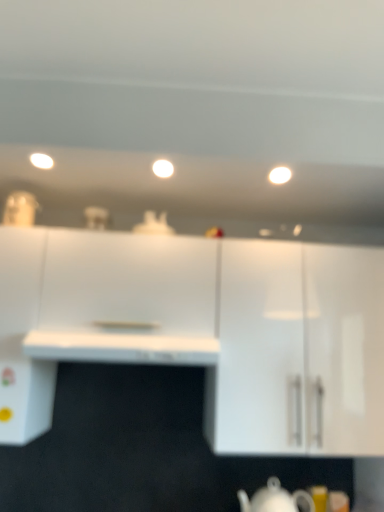
Measure the distance between white matte cabinet at left, the second cabinetry from the right, and camera.

A distance of 1.39 meters exists between white matte cabinet at left, the second cabinetry from the right, and camera.

Describe the element at coordinates (163, 168) in the screenshot. The image size is (384, 512). I see `white glossy light fixture at center, which appears as the 2th lighting when viewed from the right` at that location.

Find the location of `white glossy teapot at lower center`. white glossy teapot at lower center is located at coordinates (275, 499).

From a real-world perspective, is white glossy light fixture at center, the 2th lighting from the left, above or below white glossy light fixture at upper left, which is the first lighting from left to right?

white glossy light fixture at center, the 2th lighting from the left, is below white glossy light fixture at upper left, which is the first lighting from left to right.

Does white glossy light fixture at center, the 2th lighting from the left, contain white glossy light fixture at upper left, the 3th lighting when ordered from right to left?

No, white glossy light fixture at upper left, the 3th lighting when ordered from right to left, is not a part of white glossy light fixture at center, the 2th lighting from the left.

Would you consider white glossy light fixture at center, which appears as the 2th lighting when viewed from the right, to be distant from white glossy light fixture at upper left, the 3th lighting when ordered from right to left?

No.

Is white glossy counter top at center beside white glossy cabinet at upper right, the second cabinetry viewed from the left?

No, white glossy counter top at center is not beside white glossy cabinet at upper right, the second cabinetry viewed from the left.

Is white glossy counter top at center positioned with its back to white glossy cabinet at upper right, marked as the 1th cabinetry in a right-to-left arrangement?

No, white glossy counter top at center is not facing away from white glossy cabinet at upper right, marked as the 1th cabinetry in a right-to-left arrangement.

Considering the positions of objects white glossy counter top at center and white glossy cabinet at upper right, the second cabinetry viewed from the left, in the image provided, who is more to the right, white glossy counter top at center or white glossy cabinet at upper right, the second cabinetry viewed from the left,?

white glossy cabinet at upper right, the second cabinetry viewed from the left, is more to the right.

How different are the orientations of white glossy counter top at center and white glossy cabinet at upper right, marked as the 1th cabinetry in a right-to-left arrangement, in degrees?

9.96e-06 degrees separate the facing orientations of white glossy counter top at center and white glossy cabinet at upper right, marked as the 1th cabinetry in a right-to-left arrangement.

Visually, is white glossy teapot at lower center positioned to the left or to the right of white glossy cabinet at upper right, the second cabinetry viewed from the left?

In the image, white glossy teapot at lower center appears on the left side of white glossy cabinet at upper right, the second cabinetry viewed from the left.

Who is shorter, white glossy teapot at lower center or white glossy cabinet at upper right, the second cabinetry viewed from the left?

white glossy teapot at lower center is shorter.

Looking at this image, would you say white glossy teapot at lower center is a long distance from white glossy cabinet at upper right, marked as the 1th cabinetry in a right-to-left arrangement?

Actually, white glossy teapot at lower center and white glossy cabinet at upper right, marked as the 1th cabinetry in a right-to-left arrangement, are a little close together.

From a real-world perspective, which is physically above, white glossy teapot at lower center or white glossy cabinet at upper right, the second cabinetry viewed from the left?

white glossy cabinet at upper right, the second cabinetry viewed from the left, is physically above.

Is white matte cabinet at left, acting as the 1th cabinetry starting from the left, taller than white glossy light fixture at upper left, which is the first lighting from left to right?

Correct, white matte cabinet at left, acting as the 1th cabinetry starting from the left, is much taller as white glossy light fixture at upper left, which is the first lighting from left to right.

Which object is further away from the camera taking this photo, white matte cabinet at left, acting as the 1th cabinetry starting from the left, or white glossy light fixture at upper left, the 3th lighting when ordered from right to left?

Positioned behind is white glossy light fixture at upper left, the 3th lighting when ordered from right to left.

Is white matte cabinet at left, acting as the 1th cabinetry starting from the left, touching white glossy light fixture at upper left, the 3th lighting when ordered from right to left?

No, white matte cabinet at left, acting as the 1th cabinetry starting from the left, is not making contact with white glossy light fixture at upper left, the 3th lighting when ordered from right to left.

Is white matte cabinet at left, acting as the 1th cabinetry starting from the left, positioned with its back to white glossy light fixture at upper left, the 3th lighting when ordered from right to left?

That's not correct — white matte cabinet at left, acting as the 1th cabinetry starting from the left, is not looking away from white glossy light fixture at upper left, the 3th lighting when ordered from right to left.

This screenshot has height=512, width=384. I want to click on jug on the right of white glossy light fixture at upper left, which is the first lighting from left to right, so click(x=275, y=499).

From a real-world perspective, is white glossy teapot at lower center above or below white glossy light fixture at upper left, which is the first lighting from left to right?

In terms of real-world spatial position, white glossy teapot at lower center is below white glossy light fixture at upper left, which is the first lighting from left to right.

Looking at their sizes, would you say white glossy teapot at lower center is wider or thinner than white glossy light fixture at upper left, the 3th lighting when ordered from right to left?

Clearly, white glossy teapot at lower center has more width compared to white glossy light fixture at upper left, the 3th lighting when ordered from right to left.

Considering the relative positions of white matte cabinet at left, acting as the 1th cabinetry starting from the left, and white glossy light at upper center, which is counted as the 3th lighting, starting from the left, in the image provided, is white matte cabinet at left, acting as the 1th cabinetry starting from the left, to the right of white glossy light at upper center, which is counted as the 3th lighting, starting from the left, from the viewer's perspective?

No, white matte cabinet at left, acting as the 1th cabinetry starting from the left, is not to the right of white glossy light at upper center, which is counted as the 3th lighting, starting from the left.

Does point (43, 239) lie behind point (278, 175)?

Yes, point (43, 239) is farther from viewer.

Can you confirm if white matte cabinet at left, acting as the 1th cabinetry starting from the left, is bigger than white glossy light at upper center, marked as the first lighting in a right-to-left arrangement?

Indeed, white matte cabinet at left, acting as the 1th cabinetry starting from the left, has a larger size compared to white glossy light at upper center, marked as the first lighting in a right-to-left arrangement.

In the image, is white matte cabinet at left, acting as the 1th cabinetry starting from the left, positioned in front of or behind white glossy light at upper center, which is counted as the 3th lighting, starting from the left?

white matte cabinet at left, acting as the 1th cabinetry starting from the left, is positioned closer to the viewer than white glossy light at upper center, which is counted as the 3th lighting, starting from the left.

From a real-world perspective, which is physically above, white glossy light fixture at upper left, which is the first lighting from left to right, or white glossy light at upper center, marked as the first lighting in a right-to-left arrangement?

From a 3D spatial view, white glossy light at upper center, marked as the first lighting in a right-to-left arrangement, is above.

Based on their positions, is white glossy light fixture at upper left, which is the first lighting from left to right, located to the left or right of white glossy light at upper center, marked as the first lighting in a right-to-left arrangement?

white glossy light fixture at upper left, which is the first lighting from left to right, is to the left of white glossy light at upper center, marked as the first lighting in a right-to-left arrangement.

Choose the correct answer: Is white glossy light fixture at upper left, the 3th lighting when ordered from right to left, inside white glossy light at upper center, which is counted as the 3th lighting, starting from the left, or outside it?

white glossy light fixture at upper left, the 3th lighting when ordered from right to left, is not enclosed by white glossy light at upper center, which is counted as the 3th lighting, starting from the left.

Based on the photo, considering the relative sizes of white glossy light fixture at upper left, which is the first lighting from left to right, and white glossy light at upper center, marked as the first lighting in a right-to-left arrangement, in the image provided, is white glossy light fixture at upper left, which is the first lighting from left to right, taller than white glossy light at upper center, marked as the first lighting in a right-to-left arrangement,?

Yes.

Image resolution: width=384 pixels, height=512 pixels. Identify the location of the 1st lighting positioned above the white glossy light fixture at center, the 2th lighting from the left (from a real-world perspective). (41, 160).

I want to click on cabinetry that is on the right side of white glossy counter top at center, so click(298, 350).

When comparing their distances from white glossy counter top at center, does white glossy light fixture at upper left, the 3th lighting when ordered from right to left, or white glossy teapot at lower center seem closer?

Among the two, white glossy teapot at lower center is located nearer to white glossy counter top at center.

From the image, which object appears to be nearer to white glossy teapot at lower center, white glossy cabinet at upper right, marked as the 1th cabinetry in a right-to-left arrangement, or white glossy counter top at center?

white glossy cabinet at upper right, marked as the 1th cabinetry in a right-to-left arrangement, is positioned closer to the anchor white glossy teapot at lower center.

Estimate the real-world distances between objects in this image. Which object is further from white matte cabinet at left, the second cabinetry from the right, white glossy teapot at lower center or white glossy light at upper center, which is counted as the 3th lighting, starting from the left?

white glossy light at upper center, which is counted as the 3th lighting, starting from the left, lies further to white matte cabinet at left, the second cabinetry from the right, than the other object.

Which object lies nearer to the anchor point white glossy cabinet at upper right, marked as the 1th cabinetry in a right-to-left arrangement, white glossy teapot at lower center or white glossy light fixture at center, which appears as the 2th lighting when viewed from the right?

The object closer to white glossy cabinet at upper right, marked as the 1th cabinetry in a right-to-left arrangement, is white glossy teapot at lower center.

From the picture: Based on their spatial positions, is white matte cabinet at left, the second cabinetry from the right, or white glossy light fixture at upper left, the 3th lighting when ordered from right to left, closer to white glossy teapot at lower center?

white matte cabinet at left, the second cabinetry from the right, is closer to white glossy teapot at lower center.

Considering their positions, is white glossy teapot at lower center positioned closer to white matte cabinet at left, the second cabinetry from the right, than white glossy cabinet at upper right, marked as the 1th cabinetry in a right-to-left arrangement?

white glossy cabinet at upper right, marked as the 1th cabinetry in a right-to-left arrangement.

Based on their spatial positions, is white matte cabinet at left, acting as the 1th cabinetry starting from the left, or white glossy counter top at center closer to white glossy teapot at lower center?

white glossy counter top at center lies closer to white glossy teapot at lower center than the other object.

From the picture: When comparing their distances from white glossy light fixture at center, the 2th lighting from the left, does white glossy teapot at lower center or white glossy cabinet at upper right, marked as the 1th cabinetry in a right-to-left arrangement, seem further?

Among the two, white glossy teapot at lower center is located further to white glossy light fixture at center, the 2th lighting from the left.

I want to click on counter top between white matte cabinet at left, acting as the 1th cabinetry starting from the left, and white glossy cabinet at upper right, marked as the 1th cabinetry in a right-to-left arrangement, from left to right, so click(x=121, y=348).

Locate an element on the screen. lighting between white glossy light fixture at center, which appears as the 2th lighting when viewed from the right, and white glossy teapot at lower center, in the vertical direction is located at coordinates (280, 175).

At what (x,y) coordinates should I click in order to perform the action: click on counter top between white glossy light fixture at upper left, the 3th lighting when ordered from right to left, and white glossy teapot at lower center from top to bottom. Please return your answer as a coordinate pair (x, y). The image size is (384, 512). Looking at the image, I should click on click(121, 348).

This screenshot has width=384, height=512. Identify the location of lighting between white glossy light fixture at center, the 2th lighting from the left, and white glossy cabinet at upper right, the second cabinetry viewed from the left, from top to bottom. (280, 175).